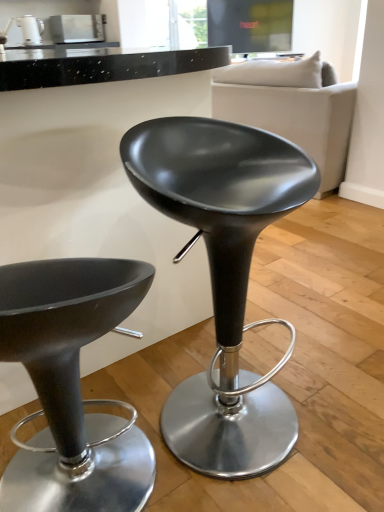
At what (x,y) coordinates should I click in order to perform the action: click on matte white kettle at upper left, positioned as the 2th appliance in right-to-left order. Please return your answer as a coordinate pair (x, y). The height and width of the screenshot is (512, 384). Looking at the image, I should click on (30, 29).

The image size is (384, 512). What do you see at coordinates (291, 108) in the screenshot?
I see `soft beige fabric couch at upper right` at bounding box center [291, 108].

At what (x,y) coordinates should I click in order to perform the action: click on matte black stool at center, arranged as the first chair when viewed from the right. Please return your answer as a coordinate pair (x, y). The height and width of the screenshot is (512, 384). Looking at the image, I should click on (224, 278).

From a real-world perspective, which object stands above the other?

From a 3D spatial view, soft beige fabric couch at upper right is above.

Which object is thinner, soft beige fabric couch at upper right or matte black stool at center, arranged as the 1th chair when viewed from the left?

With smaller width is matte black stool at center, arranged as the 1th chair when viewed from the left.

Which object is positioned more to the right, soft beige fabric couch at upper right or matte black stool at center, which is counted as the 2th chair, starting from the right?

From the viewer's perspective, soft beige fabric couch at upper right appears more on the right side.

Is matte black stool at center, which is counted as the 2th chair, starting from the right, aimed at soft beige fabric couch at upper right?

Yes, matte black stool at center, which is counted as the 2th chair, starting from the right, is aimed at soft beige fabric couch at upper right.

Which of these two, matte black stool at center, which is counted as the 2th chair, starting from the right, or soft beige fabric couch at upper right, is bigger?

soft beige fabric couch at upper right.

From the picture: From a real-world perspective, which object rests below the other?

matte black stool at center, which is counted as the 2th chair, starting from the right.

Between matte black stool at center, arranged as the 1th chair when viewed from the left, and soft beige fabric couch at upper right, which one has more height?

With more height is soft beige fabric couch at upper right.

Could you tell me if matte black stool at center, which is counted as the 2th chair, starting from the right, is turned towards matte white kettle at upper left, the first appliance viewed from the left?

No.

Is matte black stool at center, which is counted as the 2th chair, starting from the right, completely or partially outside of matte white kettle at upper left, positioned as the 2th appliance in right-to-left order?

Absolutely, matte black stool at center, which is counted as the 2th chair, starting from the right, is external to matte white kettle at upper left, positioned as the 2th appliance in right-to-left order.

Which object is closer to the camera, matte black stool at center, arranged as the 1th chair when viewed from the left, or matte white kettle at upper left, the first appliance viewed from the left?

matte black stool at center, arranged as the 1th chair when viewed from the left, is closer to the camera.

Is there a large distance between matte black stool at center, arranged as the 1th chair when viewed from the left, and matte white kettle at upper left, positioned as the 2th appliance in right-to-left order?

Indeed, matte black stool at center, arranged as the 1th chair when viewed from the left, is not near matte white kettle at upper left, positioned as the 2th appliance in right-to-left order.

From the image's perspective, is matte black stool at center, arranged as the first chair when viewed from the right, on top of matte white kettle at upper left, positioned as the 2th appliance in right-to-left order?

No, from the image's perspective, matte black stool at center, arranged as the first chair when viewed from the right, is not over matte white kettle at upper left, positioned as the 2th appliance in right-to-left order.

Which point is more distant from viewer, (249, 261) or (26, 28)?

The point (26, 28) is behind.

Is matte black stool at center, arranged as the first chair when viewed from the right, to the left of matte white kettle at upper left, positioned as the 2th appliance in right-to-left order, from the viewer's perspective?

Incorrect, matte black stool at center, arranged as the first chair when viewed from the right, is not on the left side of matte white kettle at upper left, positioned as the 2th appliance in right-to-left order.

Between matte white kettle at upper left, the first appliance viewed from the left, and matte black stool at center, which is counted as the 2th chair, starting from the right, which one appears on the left side from the viewer's perspective?

matte white kettle at upper left, the first appliance viewed from the left, is more to the left.

Could you tell me if matte white kettle at upper left, the first appliance viewed from the left, is turned towards matte black stool at center, arranged as the 1th chair when viewed from the left?

No, matte white kettle at upper left, the first appliance viewed from the left, is not aimed at matte black stool at center, arranged as the 1th chair when viewed from the left.

Is matte white kettle at upper left, the first appliance viewed from the left, with matte black stool at center, arranged as the 1th chair when viewed from the left?

No, matte white kettle at upper left, the first appliance viewed from the left, is not beside matte black stool at center, arranged as the 1th chair when viewed from the left.

From a real-world perspective, is matte white kettle at upper left, positioned as the 2th appliance in right-to-left order, positioned over matte black stool at center, which is counted as the 2th chair, starting from the right, based on gravity?

Yes.

From the picture: Measure the distance between soft beige fabric couch at upper right and matte white kettle at upper left, positioned as the 2th appliance in right-to-left order.

The distance of soft beige fabric couch at upper right from matte white kettle at upper left, positioned as the 2th appliance in right-to-left order, is 2.58 meters.

Is matte white kettle at upper left, positioned as the 2th appliance in right-to-left order, located within soft beige fabric couch at upper right?

Actually, matte white kettle at upper left, positioned as the 2th appliance in right-to-left order, is outside soft beige fabric couch at upper right.

In terms of width, does soft beige fabric couch at upper right look wider or thinner when compared to matte white kettle at upper left, the first appliance viewed from the left?

soft beige fabric couch at upper right is wider than matte white kettle at upper left, the first appliance viewed from the left.

Looking at this image, can you confirm if matte black stool at center, the second chair from the left, is wider than metallic stainless steel kettle at upper left, the 2th appliance in the left-to-right sequence?

Yes.

From a real-world perspective, is matte black stool at center, arranged as the first chair when viewed from the right, positioned above or below metallic stainless steel kettle at upper left, the 2th appliance in the left-to-right sequence?

In terms of real-world spatial position, matte black stool at center, arranged as the first chair when viewed from the right, is below metallic stainless steel kettle at upper left, the 2th appliance in the left-to-right sequence.

From the image's perspective, which one is positioned lower, matte black stool at center, the second chair from the left, or metallic stainless steel kettle at upper left, the 2th appliance in the left-to-right sequence?

matte black stool at center, the second chair from the left, from the image's perspective.

Locate an element on the screen. the 1st appliance to the left of the matte black stool at center, the second chair from the left, starting your count from the anchor is located at coordinates (77, 28).

Where is `couch lying above the matte black stool at center, which is counted as the 2th chair, starting from the right (from the image's perspective)`? This screenshot has width=384, height=512. couch lying above the matte black stool at center, which is counted as the 2th chair, starting from the right (from the image's perspective) is located at coordinates (291, 108).

Locate an element on the screen. Image resolution: width=384 pixels, height=512 pixels. the 2nd chair below the soft beige fabric couch at upper right (from the image's perspective) is located at coordinates (72, 386).

Based on their spatial positions, is soft beige fabric couch at upper right or matte black stool at center, arranged as the 1th chair when viewed from the left, closer to metallic stainless steel kettle at upper left, which ranks as the 1th appliance in right-to-left order?

Based on the image, soft beige fabric couch at upper right appears to be nearer to metallic stainless steel kettle at upper left, which ranks as the 1th appliance in right-to-left order.

Which object lies nearer to the anchor point metallic stainless steel kettle at upper left, which ranks as the 1th appliance in right-to-left order, matte black stool at center, arranged as the first chair when viewed from the right, or matte black stool at center, arranged as the 1th chair when viewed from the left?

matte black stool at center, arranged as the first chair when viewed from the right, is closer to metallic stainless steel kettle at upper left, which ranks as the 1th appliance in right-to-left order.

Based on the photo, which object lies nearer to the anchor point metallic stainless steel kettle at upper left, which ranks as the 1th appliance in right-to-left order, matte black stool at center, arranged as the first chair when viewed from the right, or matte white kettle at upper left, positioned as the 2th appliance in right-to-left order?

matte white kettle at upper left, positioned as the 2th appliance in right-to-left order, lies closer to metallic stainless steel kettle at upper left, which ranks as the 1th appliance in right-to-left order, than the other object.

Based on their spatial positions, is matte white kettle at upper left, the first appliance viewed from the left, or matte black stool at center, the second chair from the left, further from metallic stainless steel kettle at upper left, which ranks as the 1th appliance in right-to-left order?

matte black stool at center, the second chair from the left, lies further to metallic stainless steel kettle at upper left, which ranks as the 1th appliance in right-to-left order, than the other object.

When comparing their distances from metallic stainless steel kettle at upper left, the 2th appliance in the left-to-right sequence, does matte white kettle at upper left, positioned as the 2th appliance in right-to-left order, or soft beige fabric couch at upper right seem further?

soft beige fabric couch at upper right.

In the scene shown: Estimate the real-world distances between objects in this image. Which object is further from metallic stainless steel kettle at upper left, which ranks as the 1th appliance in right-to-left order, matte white kettle at upper left, the first appliance viewed from the left, or matte black stool at center, arranged as the 1th chair when viewed from the left?

matte black stool at center, arranged as the 1th chair when viewed from the left, is further to metallic stainless steel kettle at upper left, which ranks as the 1th appliance in right-to-left order.

Based on their spatial positions, is metallic stainless steel kettle at upper left, the 2th appliance in the left-to-right sequence, or matte black stool at center, the second chair from the left, closer to matte white kettle at upper left, positioned as the 2th appliance in right-to-left order?

The object closer to matte white kettle at upper left, positioned as the 2th appliance in right-to-left order, is metallic stainless steel kettle at upper left, the 2th appliance in the left-to-right sequence.

From the image, which object appears to be nearer to soft beige fabric couch at upper right, metallic stainless steel kettle at upper left, which ranks as the 1th appliance in right-to-left order, or matte white kettle at upper left, positioned as the 2th appliance in right-to-left order?

metallic stainless steel kettle at upper left, which ranks as the 1th appliance in right-to-left order, is positioned closer to the anchor soft beige fabric couch at upper right.

Identify the location of chair between matte black stool at center, arranged as the 1th chair when viewed from the left, and matte white kettle at upper left, positioned as the 2th appliance in right-to-left order, from front to back. (224, 278).

Find the location of `chair positioned between matte black stool at center, which is counted as the 2th chair, starting from the right, and soft beige fabric couch at upper right from near to far`. chair positioned between matte black stool at center, which is counted as the 2th chair, starting from the right, and soft beige fabric couch at upper right from near to far is located at coordinates (224, 278).

The height and width of the screenshot is (512, 384). Find the location of `couch located between matte black stool at center, arranged as the first chair when viewed from the right, and metallic stainless steel kettle at upper left, which ranks as the 1th appliance in right-to-left order, in the depth direction`. couch located between matte black stool at center, arranged as the first chair when viewed from the right, and metallic stainless steel kettle at upper left, which ranks as the 1th appliance in right-to-left order, in the depth direction is located at coordinates (291, 108).

Find the location of a particular element. couch between matte black stool at center, arranged as the 1th chair when viewed from the left, and metallic stainless steel kettle at upper left, which ranks as the 1th appliance in right-to-left order, along the z-axis is located at coordinates (291, 108).